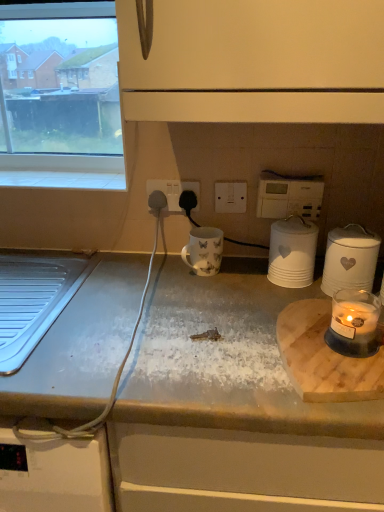
Question: Can you confirm if white marble countertop at center is thinner than translucent glass candle at right?

Choices:
 (A) yes
 (B) no

Answer: (B)

Question: Is white marble countertop at center at the right side of translucent glass candle at right?

Choices:
 (A) yes
 (B) no

Answer: (B)

Question: Is white marble countertop at center far away from translucent glass candle at right?

Choices:
 (A) no
 (B) yes

Answer: (A)

Question: From the image's perspective, is white marble countertop at center on translucent glass candle at right?

Choices:
 (A) yes
 (B) no

Answer: (B)

Question: Does white marble countertop at center lie behind translucent glass candle at right?

Choices:
 (A) yes
 (B) no

Answer: (B)

Question: Is translucent glass candle at right located within white marble countertop at center?

Choices:
 (A) yes
 (B) no

Answer: (B)

Question: Is white glossy mug at center further to the viewer compared to white marble countertop at center?

Choices:
 (A) no
 (B) yes

Answer: (B)

Question: Does white glossy mug at center have a greater width compared to white marble countertop at center?

Choices:
 (A) yes
 (B) no

Answer: (B)

Question: Is white glossy mug at center positioned with its back to white marble countertop at center?

Choices:
 (A) yes
 (B) no

Answer: (B)

Question: Can you confirm if white glossy mug at center is taller than white marble countertop at center?

Choices:
 (A) no
 (B) yes

Answer: (A)

Question: Considering the relative positions of white glossy mug at center and white marble countertop at center in the image provided, is white glossy mug at center to the right of white marble countertop at center from the viewer's perspective?

Choices:
 (A) yes
 (B) no

Answer: (B)

Question: From the image's perspective, is white glossy mug at center above white marble countertop at center?

Choices:
 (A) yes
 (B) no

Answer: (A)

Question: From the image's perspective, is white marble countertop at center beneath white ceramic jar at right, which ranks as the second kitchen appliance in left-to-right order?

Choices:
 (A) yes
 (B) no

Answer: (A)